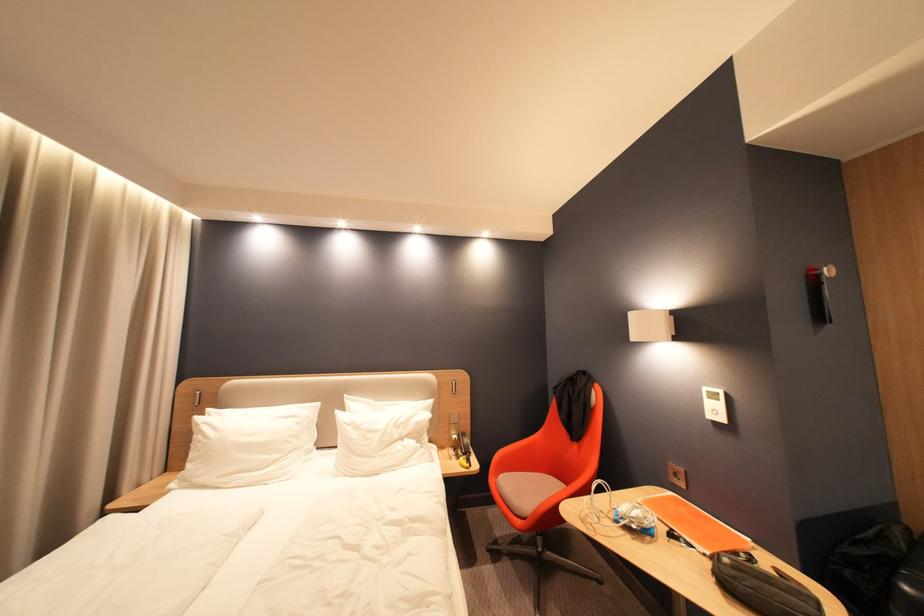
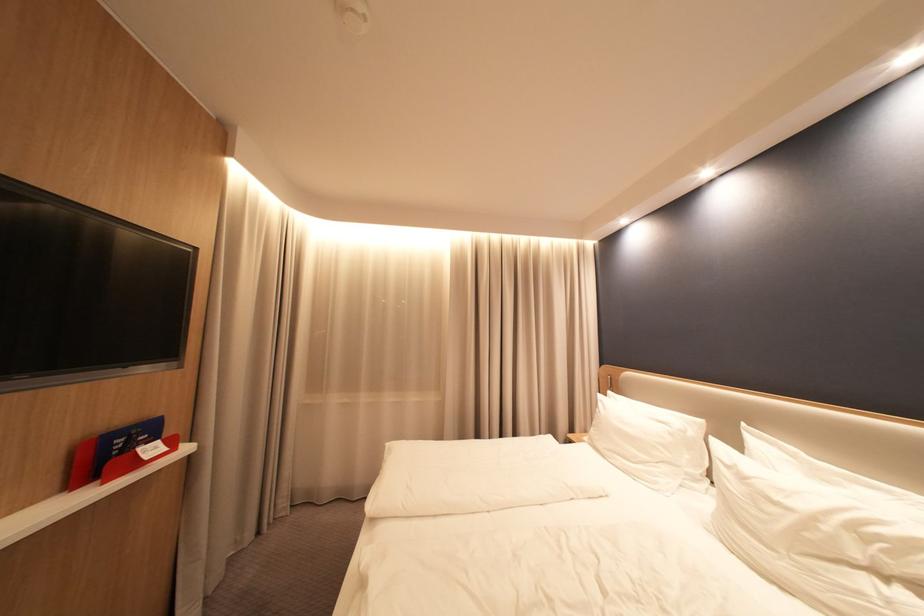
The point at (359, 424) is marked in the first image. Where is the corresponding point in the second image?

(737, 464)